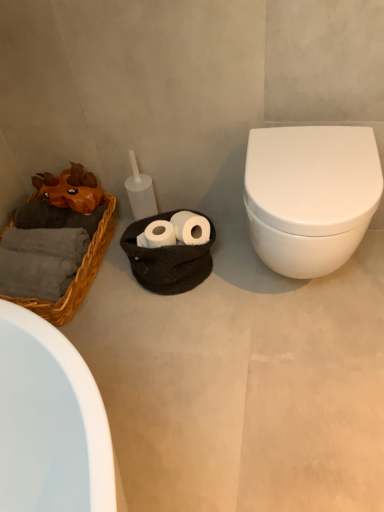
Question: From a real-world perspective, relative to woven wicker basket at left, is white matte toilet at right vertically above or below?

Choices:
 (A) above
 (B) below

Answer: (B)

Question: From the image's perspective, is white matte toilet at right located above or below woven wicker basket at left?

Choices:
 (A) above
 (B) below

Answer: (B)

Question: Based on their relative distances, which object is farther from the woven wicker basket at left?

Choices:
 (A) orange chiffonier at left
 (B) white glossy toilet at right
 (C) white matte toilet at right

Answer: (B)

Question: Which of these objects is positioned farthest from the orange chiffonier at left?

Choices:
 (A) white glossy toilet at right
 (B) white matte toilet at right
 (C) woven wicker basket at left

Answer: (A)